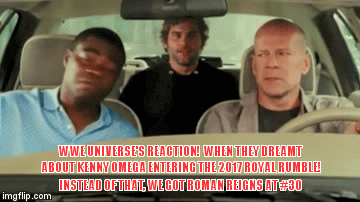
The image size is (360, 202). I want to click on mirror, so click(x=194, y=9).